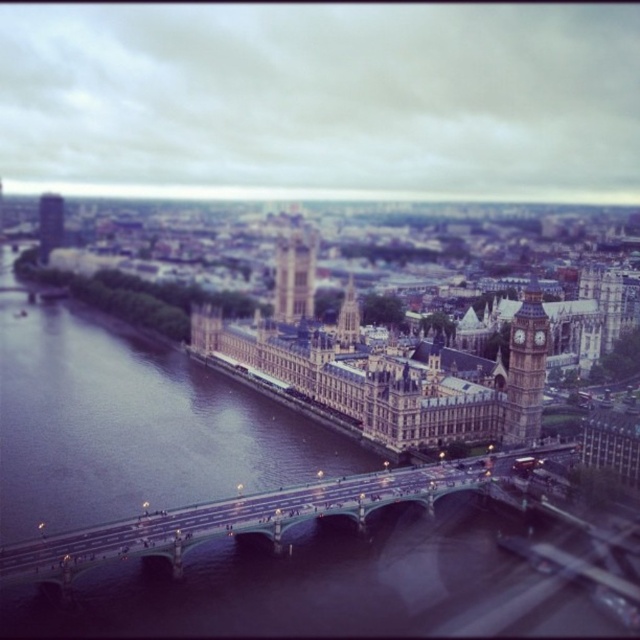
Question: Which point appears farthest from the camera in this image?

Choices:
 (A) (289, 246)
 (B) (195, 508)
 (C) (61, 209)
 (D) (516, 368)

Answer: (C)

Question: From the image, what is the correct spatial relationship of metallic gray bridge at center in relation to stone clock tower at center?

Choices:
 (A) above
 (B) below

Answer: (B)

Question: Which object is the closest to the stone clock tower at center?

Choices:
 (A) metallic gray bridge at center
 (B) golden stone big ben at upper left
 (C) stone clock tower at right

Answer: (C)

Question: Which point is farther to the camera?

Choices:
 (A) golden stone big ben at upper left
 (B) stone clock tower at center

Answer: (A)

Question: Does metallic gray bridge at center have a lesser width compared to golden stone big ben at upper left?

Choices:
 (A) yes
 (B) no

Answer: (B)

Question: Can you confirm if stone clock tower at center is thinner than golden stone big ben at upper left?

Choices:
 (A) no
 (B) yes

Answer: (B)